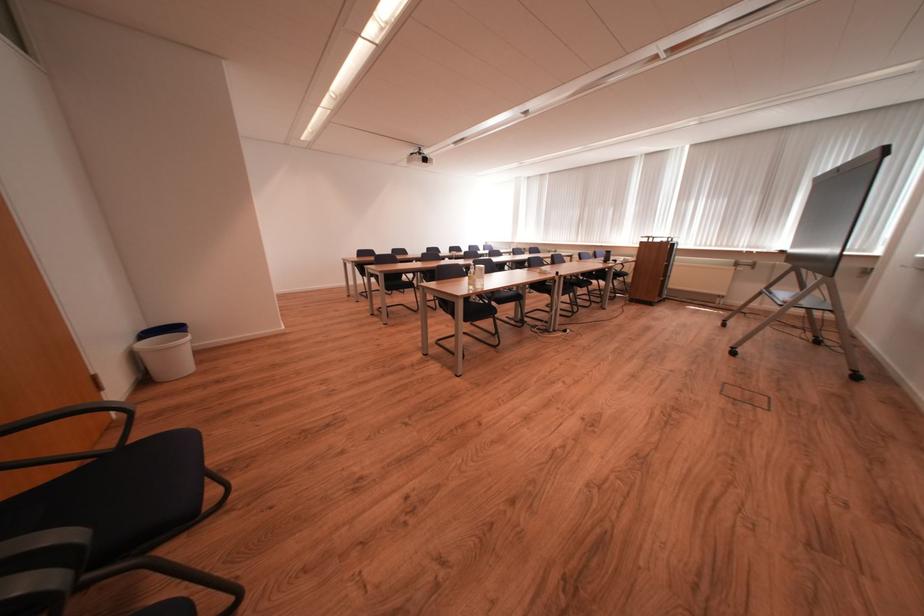
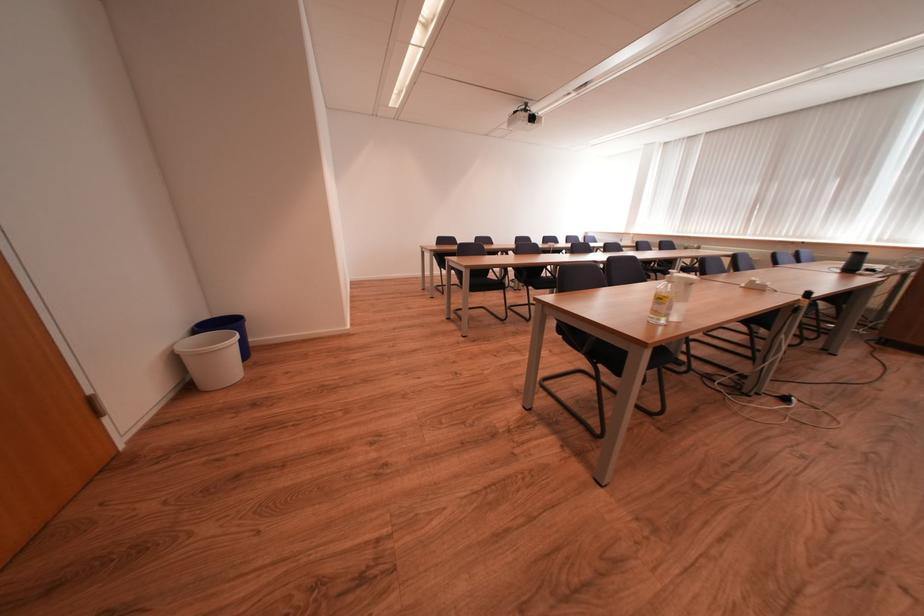
Where in the second image is the point corresponding to (x=403, y=284) from the first image?

(489, 283)